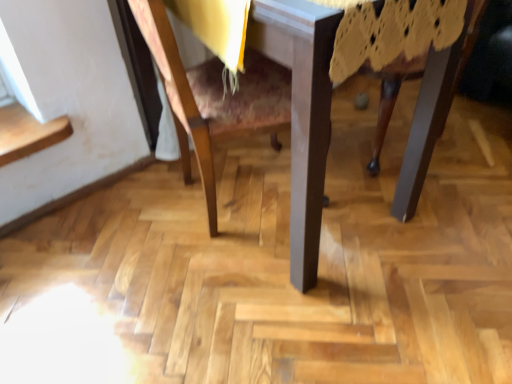
This screenshot has width=512, height=384. Find the location of `vacant space in between wooden table at center and wooden chair at center`. vacant space in between wooden table at center and wooden chair at center is located at coordinates coord(223,249).